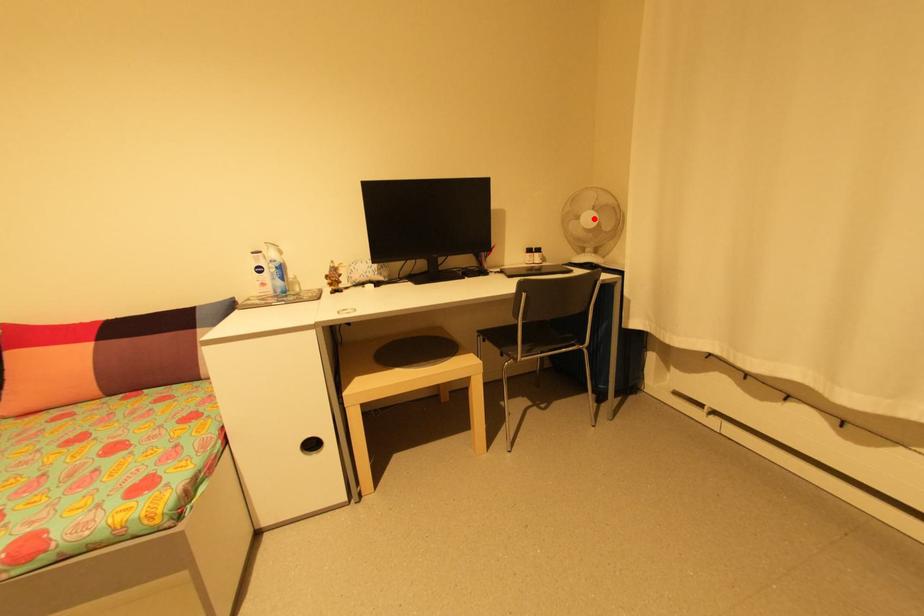
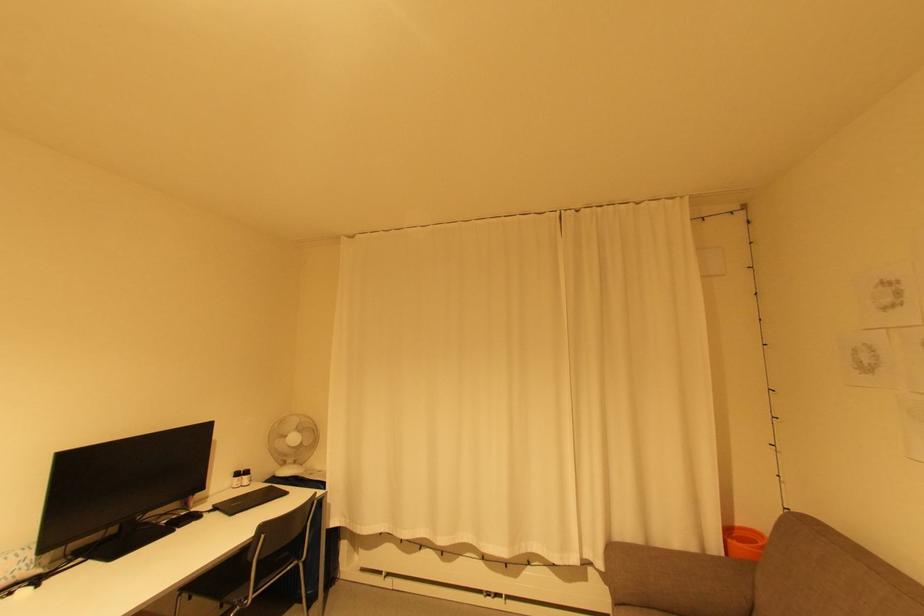
Find the pixel in the second image that matches the highlighted location in the first image.

(298, 439)